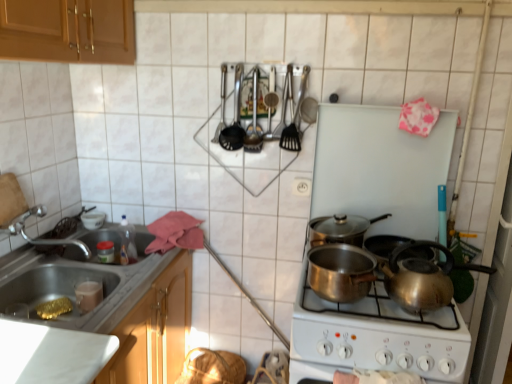
Question: Is metallic sink at lower left a part of shiny silver pot at center, which is the second kitchen appliance in bottom-to-top order?

Choices:
 (A) no
 (B) yes

Answer: (A)

Question: Does shiny silver pot at center, which is the second kitchen appliance in bottom-to-top order, appear on the right side of metallic sink at lower left?

Choices:
 (A) no
 (B) yes

Answer: (B)

Question: Can you confirm if shiny silver pot at center, which is the second kitchen appliance in bottom-to-top order, is shorter than metallic sink at lower left?

Choices:
 (A) no
 (B) yes

Answer: (B)

Question: Is shiny silver pot at center, which is the 1th kitchen appliance in top-to-bottom order, looking in the opposite direction of metallic sink at lower left?

Choices:
 (A) no
 (B) yes

Answer: (A)

Question: From a real-world perspective, is shiny silver pot at center, which is the 1th kitchen appliance in top-to-bottom order, below metallic sink at lower left?

Choices:
 (A) yes
 (B) no

Answer: (B)

Question: Looking at their shapes, would you say metallic cooking utensils at upper center is wider or thinner than polished stainless steel utensils at upper center?

Choices:
 (A) thin
 (B) wide

Answer: (A)

Question: Does point (236, 77) appear closer or farther from the camera than point (301, 86)?

Choices:
 (A) farther
 (B) closer

Answer: (A)

Question: From a real-world perspective, relative to polished stainless steel utensils at upper center, is metallic cooking utensils at upper center vertically above or below?

Choices:
 (A) above
 (B) below

Answer: (A)

Question: Considering the positions of metallic cooking utensils at upper center and polished stainless steel utensils at upper center in the image, is metallic cooking utensils at upper center bigger or smaller than polished stainless steel utensils at upper center?

Choices:
 (A) big
 (B) small

Answer: (B)

Question: From the image's perspective, is satin silver kettle at lower right located above or below polished stainless steel utensils at upper center?

Choices:
 (A) above
 (B) below

Answer: (B)

Question: Which is correct: satin silver kettle at lower right is inside polished stainless steel utensils at upper center, or outside of it?

Choices:
 (A) outside
 (B) inside

Answer: (A)

Question: From a real-world perspective, relative to polished stainless steel utensils at upper center, is satin silver kettle at lower right vertically above or below?

Choices:
 (A) above
 (B) below

Answer: (B)

Question: Considering the relative positions of satin silver kettle at lower right and polished stainless steel utensils at upper center in the image provided, is satin silver kettle at lower right to the left or to the right of polished stainless steel utensils at upper center?

Choices:
 (A) left
 (B) right

Answer: (B)

Question: Is polished copper pot at center, the first kitchen appliance ordered from the bottom, taller or shorter than shiny silver pot at center, which is the second kitchen appliance in bottom-to-top order?

Choices:
 (A) short
 (B) tall

Answer: (B)

Question: From a real-world perspective, is polished copper pot at center, the first kitchen appliance ordered from the bottom, above or below shiny silver pot at center, which is the 1th kitchen appliance in top-to-bottom order?

Choices:
 (A) below
 (B) above

Answer: (A)